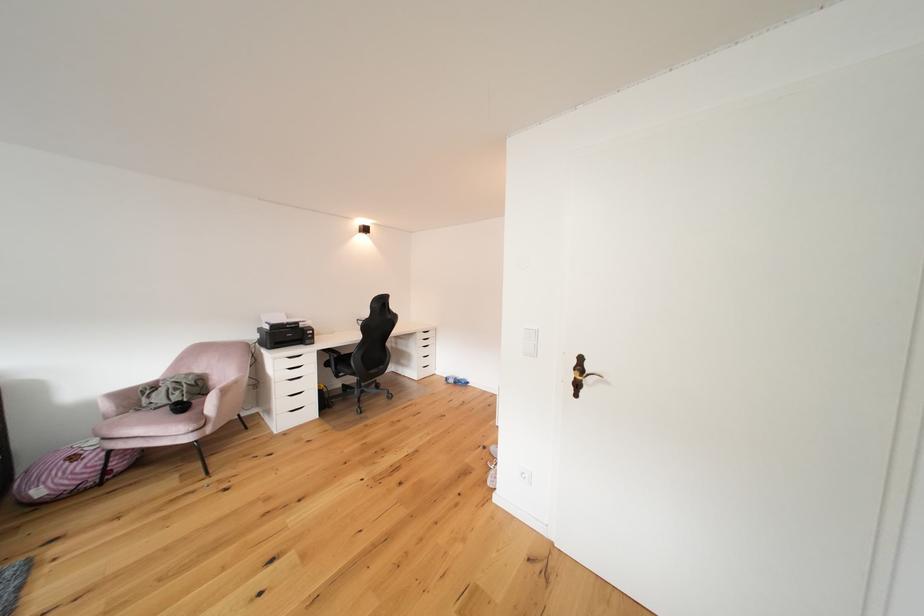
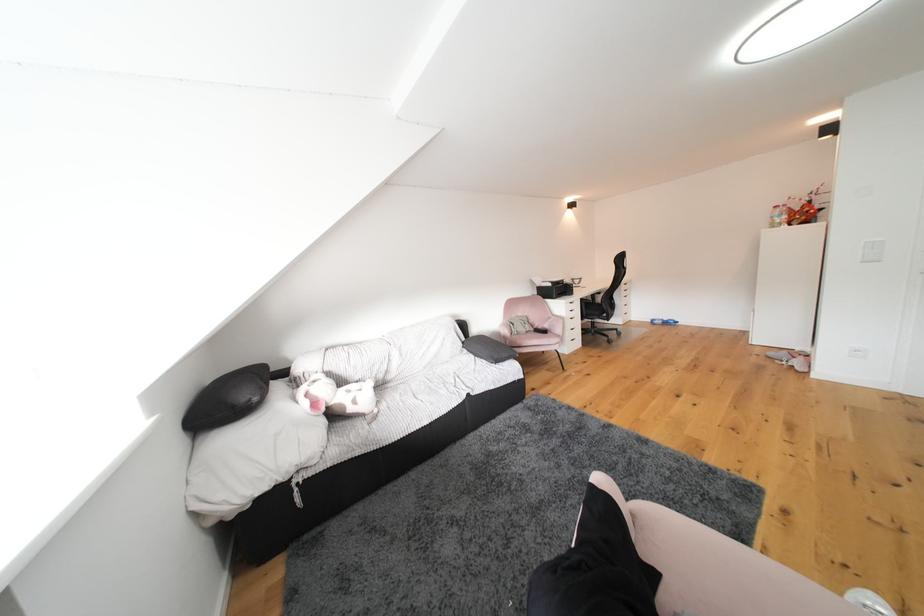
Locate, in the second image, the point that corresponds to point 307,328 in the first image.

(572, 285)